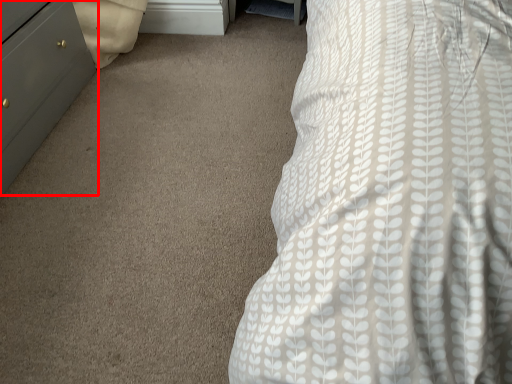
Question: From the image's perspective, where is chest of drawers (annotated by the red box) located in relation to file cabinet in the image?

Choices:
 (A) above
 (B) below

Answer: (B)